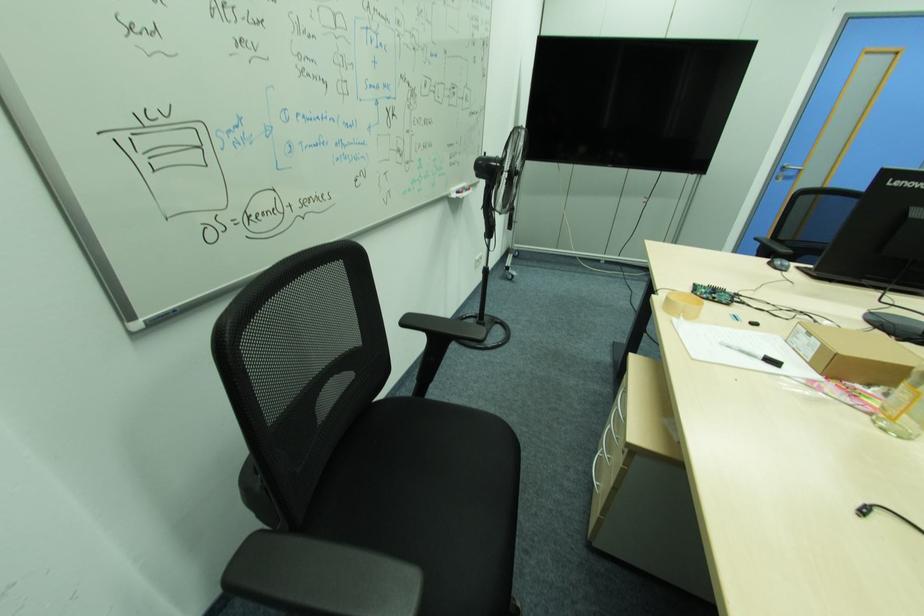
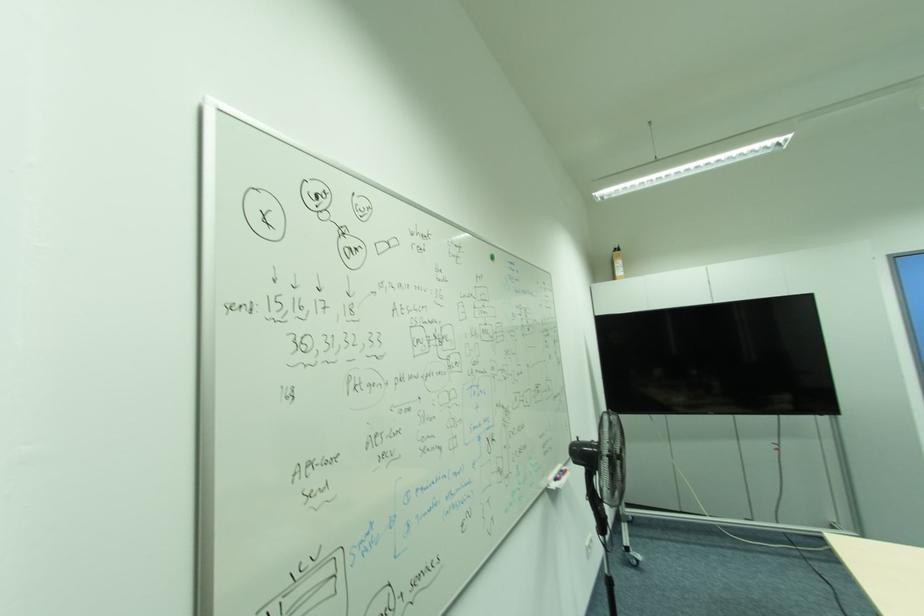
In the second image, find the point that corresponds to [518,175] in the first image.

(621, 459)